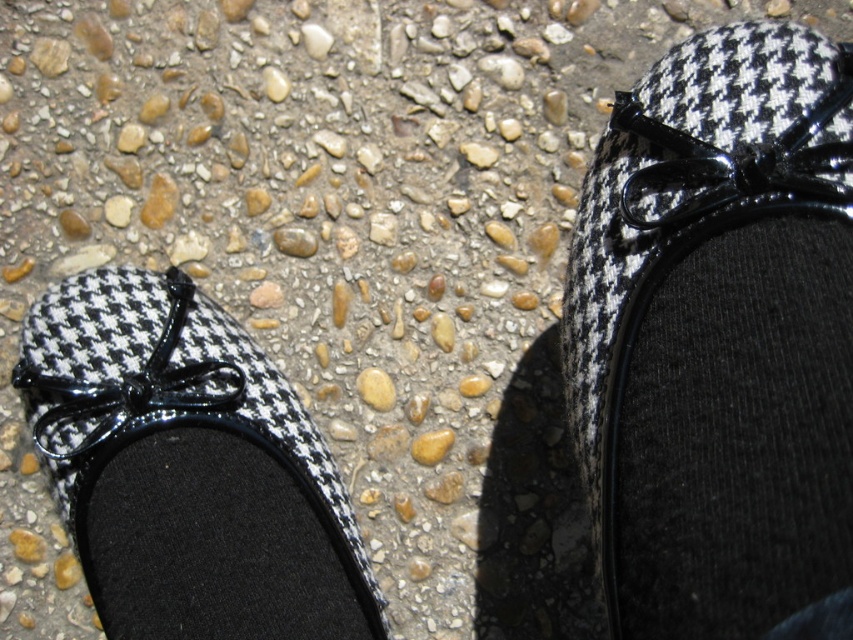
You are a photographer trying to capture a detailed shot of the point at coordinates [730,362]. If your camera is currently positioned 22.60 inches away from that point, is this distance suitable for a clear closeup?

The point at coordinates [730,362] is 22.60 inches away from the camera. This distance may be too far for a clear closeup, as closeups typically require the camera to be much closer to the subject.

You are a photographer taking a close look at the image of two feet in black and white houndstooth ballet flats. You notice a specific point marked at coordinates point (x=718, y=339). Based on the scene description, can you determine which object this point is located on?

The point (x=718, y=339) is located on the houndstooth fabric shoe at upper right.